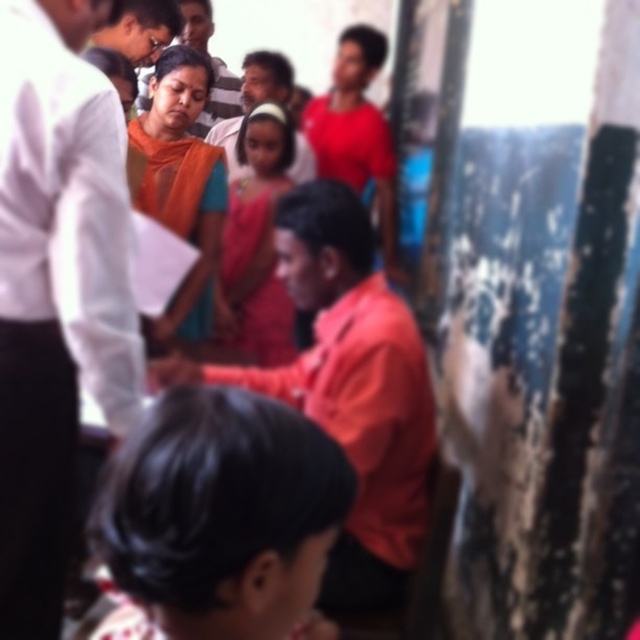
Question: Which of the following is the farthest from the observer?

Choices:
 (A) black hair at lower center
 (B) matte orange sari at center

Answer: (B)

Question: Does orange matte shirt at center appear on the left side of matte orange shirt at center?

Choices:
 (A) no
 (B) yes

Answer: (A)

Question: Which object appears closest to the camera in this image?

Choices:
 (A) matte orange sari at upper center
 (B) matte orange sari at center
 (C) orange matte shirt at center
 (D) black hair at lower center

Answer: (D)

Question: Observing the image, what is the correct spatial positioning of matte white shirt at center in reference to matte orange sari at upper center?

Choices:
 (A) left
 (B) right

Answer: (B)

Question: From the image, what is the correct spatial relationship of orange fabric saree at center in relation to matte orange sari at upper center?

Choices:
 (A) right
 (B) left

Answer: (A)

Question: Which object appears farthest from the camera in this image?

Choices:
 (A) orange matte shirt at center
 (B) pink satin dress at center
 (C) orange fabric saree at center

Answer: (B)